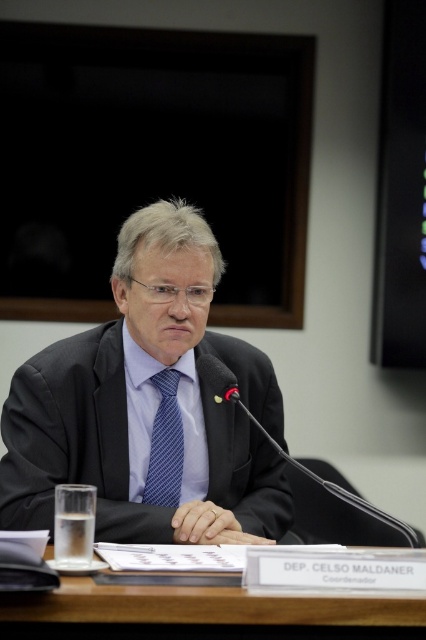
Which of these two, matte black suit at center or blue striped tie at center, stands taller?

matte black suit at center

Which is in front, point (129, 228) or point (144, 492)?

Positioned in front is point (144, 492).

The image size is (426, 640). In order to click on matte black suit at center in this screenshot , I will do `click(149, 406)`.

Is point (149, 586) positioned before point (167, 442)?

Yes, it is in front of point (167, 442).

Where is `brown wooden table at center`? This screenshot has width=426, height=640. brown wooden table at center is located at coordinates (201, 612).

Between matte black suit at center and brown wooden table at center, which one appears on the left side from the viewer's perspective?

matte black suit at center is more to the left.

Can you confirm if matte black suit at center is positioned to the right of brown wooden table at center?

No, matte black suit at center is not to the right of brown wooden table at center.

The image size is (426, 640). Describe the element at coordinates (149, 406) in the screenshot. I see `matte black suit at center` at that location.

Where is `matte black suit at center`? matte black suit at center is located at coordinates (149, 406).